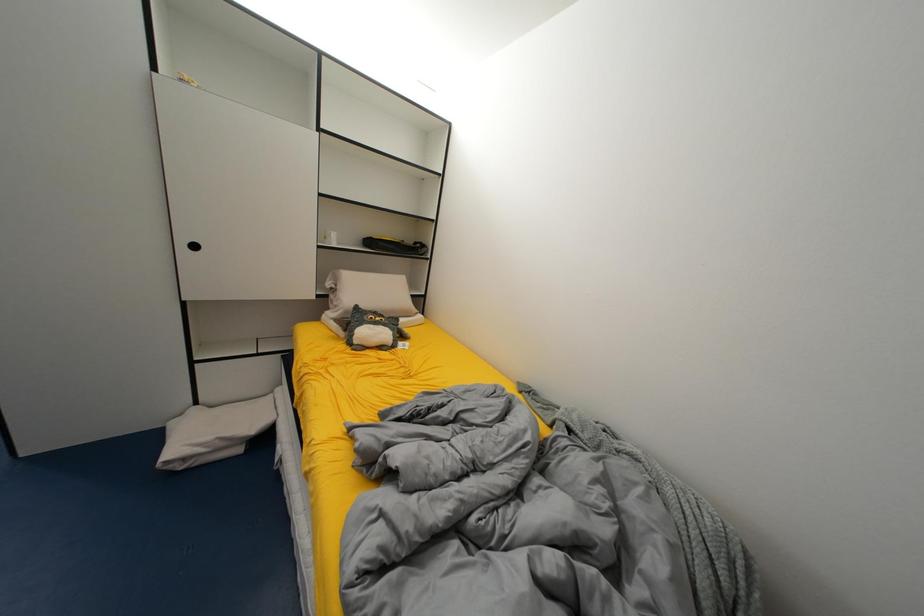
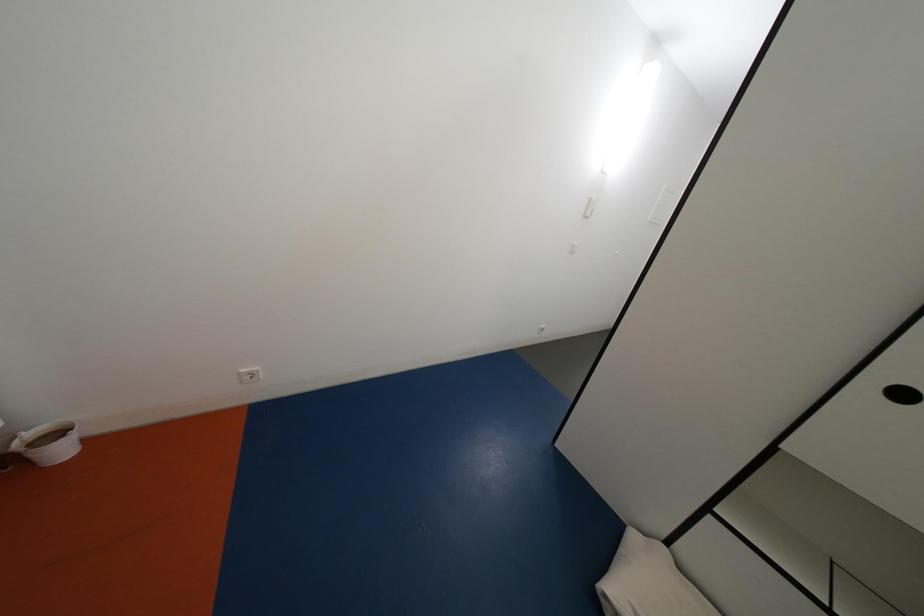
Question: The first image is from the beginning of the video and the second image is from the end. How did the camera likely rotate when shooting the video?

Choices:
 (A) Left
 (B) Right
 (C) Up
 (D) Down

Answer: (A)